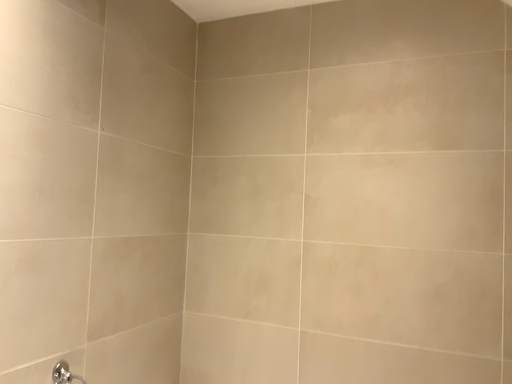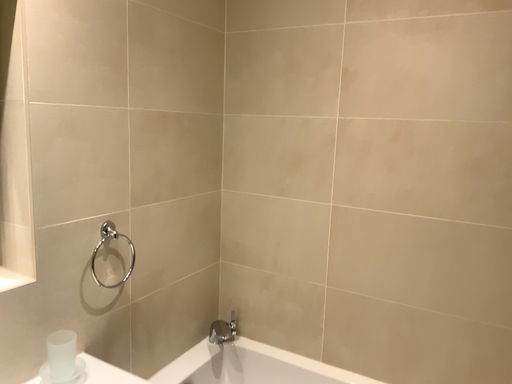
Question: How did the camera likely rotate when shooting the video?

Choices:
 (A) rotated downward
 (B) rotated upward

Answer: (A)